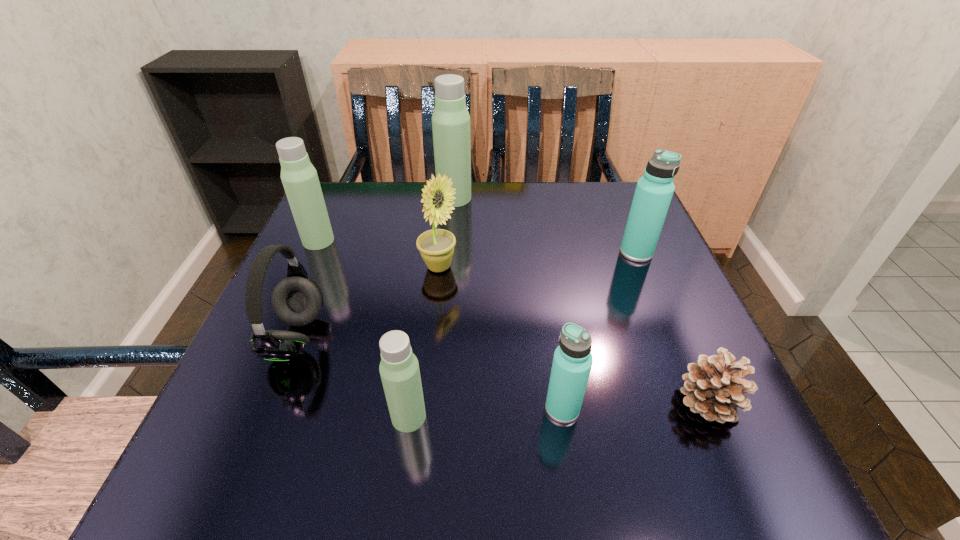
At what (x,y) coordinates should I click in order to perform the action: click on the left aqua thermos bottle. Please return your answer as a coordinate pair (x, y). The width and height of the screenshot is (960, 540). Looking at the image, I should click on (572, 362).

Where is `brown pinecone`? The image size is (960, 540). brown pinecone is located at coordinates (714, 387).

Where is `the shortest object`? Image resolution: width=960 pixels, height=540 pixels. the shortest object is located at coordinates pos(714,387).

Find the location of `free spot located on the right of the biggest light thermos bottle`. free spot located on the right of the biggest light thermos bottle is located at coordinates (540, 198).

What are the coordinates of `free region located 0.310m on the front of the rightmost thermos bottle` in the screenshot? It's located at (691, 384).

Image resolution: width=960 pixels, height=540 pixels. I want to click on free space located on the back of the leftmost thermos bottle, so click(x=345, y=182).

Identify the location of free space located on the face of the yellow sunflower. (524, 267).

Locate an element on the screen. The width and height of the screenshot is (960, 540). free region located on the ear cups of the headset is located at coordinates [526, 338].

Identify the location of free region located 0.170m on the back of the nearest light thermos bottle. This screenshot has width=960, height=540. (421, 322).

Identify the location of vacant region located 0.320m on the left of the second thermos bottle from right to left. The width and height of the screenshot is (960, 540). (341, 408).